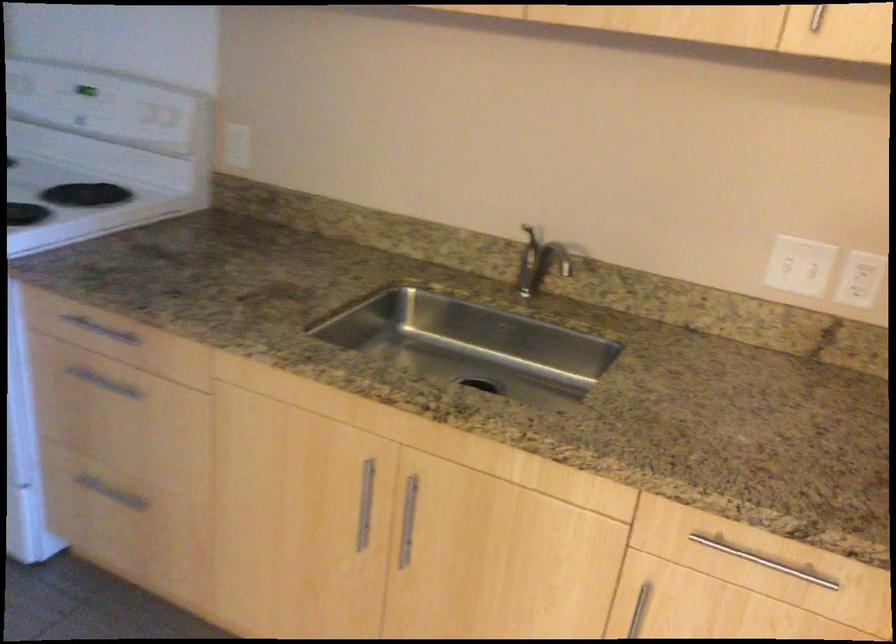
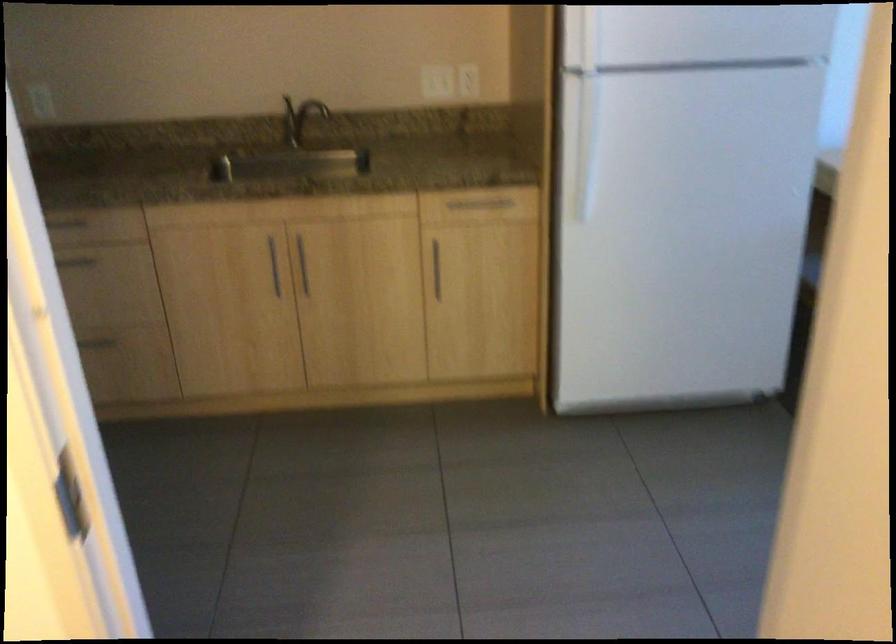
Where in the second image is the point corresponding to pixel 363 495 from the first image?

(273, 265)